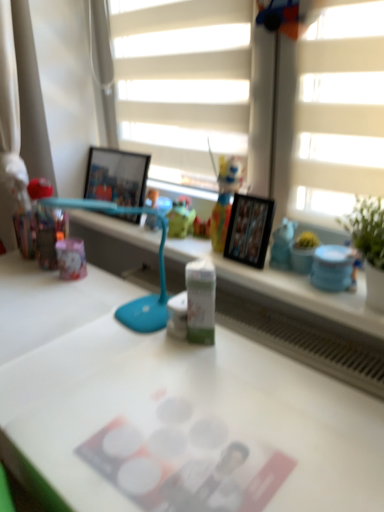
The width and height of the screenshot is (384, 512). What are the coordinates of `vacant region in front of teal plastic table lamp at center` in the screenshot? It's located at (115, 382).